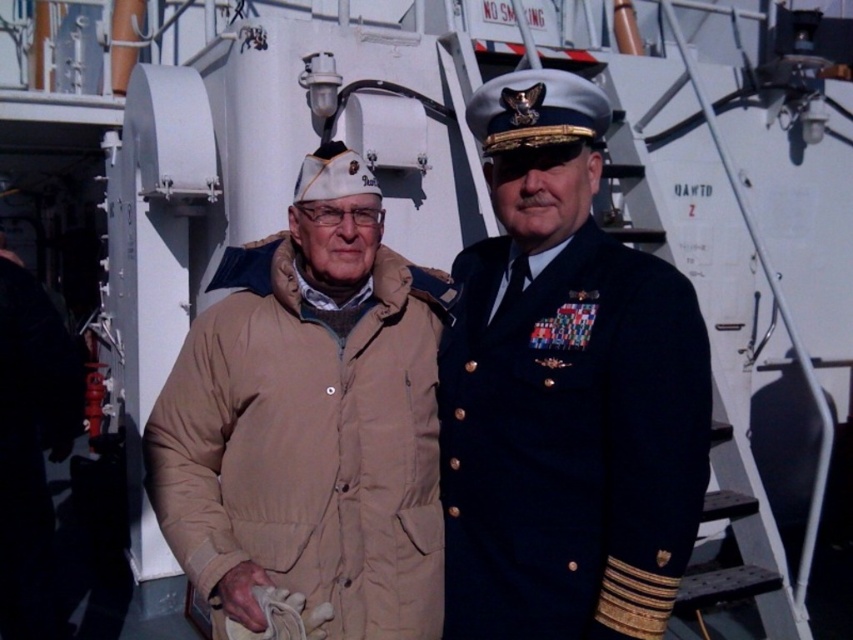
Can you confirm if navy blue woolen jacket at center is bigger than tan quilted jacket at center?

Actually, navy blue woolen jacket at center might be smaller than tan quilted jacket at center.

Between navy blue woolen jacket at center and tan quilted jacket at center, which one is positioned lower?

tan quilted jacket at center is below.

Is point (582, 512) more distant than point (366, 531)?

No, it is in front of (366, 531).

Locate an element on the screen. navy blue woolen jacket at center is located at coordinates (570, 442).

Is tan fabric jacket at center behind tan quilted jacket at center?

No.

Is point (486, 276) positioned before point (186, 564)?

No, it is not.

Is point (444, 387) closer to camera compared to point (312, 460)?

No, it is behind (312, 460).

The width and height of the screenshot is (853, 640). I want to click on tan fabric jacket at center, so click(x=564, y=392).

Is tan fabric jacket at center smaller than navy blue woolen jacket at center?

No.

Does tan fabric jacket at center have a greater width compared to navy blue woolen jacket at center?

Correct, the width of tan fabric jacket at center exceeds that of navy blue woolen jacket at center.

Is point (556, 77) positioned before point (512, 477)?

Yes.

Locate an element on the screen. The height and width of the screenshot is (640, 853). tan fabric jacket at center is located at coordinates (564, 392).